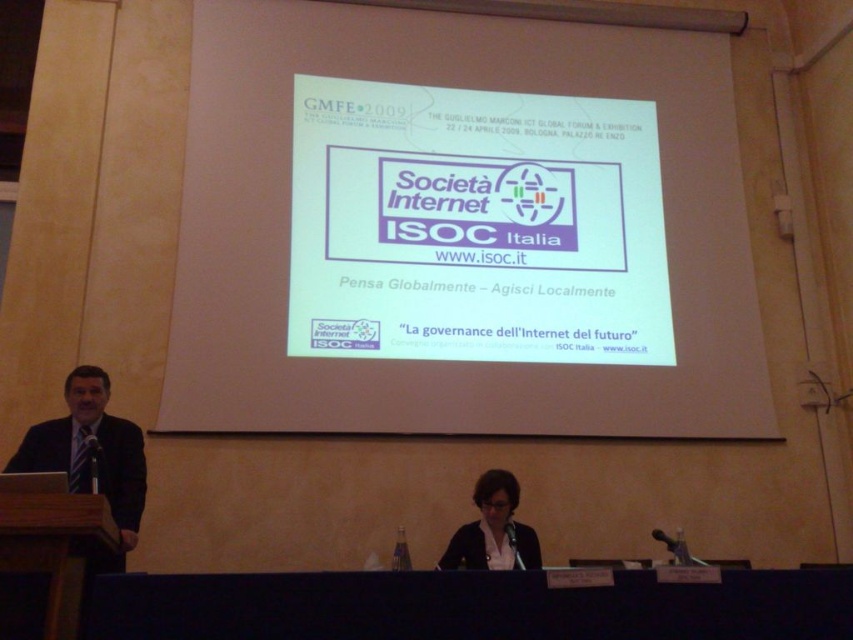
Who is more distant from viewer, (56, 452) or (468, 556)?

The point (468, 556) is behind.

Between point (84, 388) and point (502, 568), which one is positioned behind?

The point (502, 568) is behind.

Where is `dark suit at left`? dark suit at left is located at coordinates (91, 456).

Who is positioned more to the right, white paper at upper center or wooden at lower left?

From the viewer's perspective, white paper at upper center appears more on the right side.

Between point (756, 330) and point (9, 500), which one is positioned in front?

Positioned in front is point (9, 500).

This screenshot has width=853, height=640. In order to click on white paper at upper center in this screenshot , I will do `click(460, 228)`.

Which of these two, dark suit at left or matte black jacket at center, stands taller?

With more height is dark suit at left.

Looking at this image, how much distance is there between dark suit at left and matte black jacket at center?

Result: dark suit at left and matte black jacket at center are 5.87 feet apart from each other.

Between point (74, 390) and point (485, 541), which one is positioned behind?

Positioned behind is point (485, 541).

Where is `dark suit at left`? The height and width of the screenshot is (640, 853). dark suit at left is located at coordinates (91, 456).